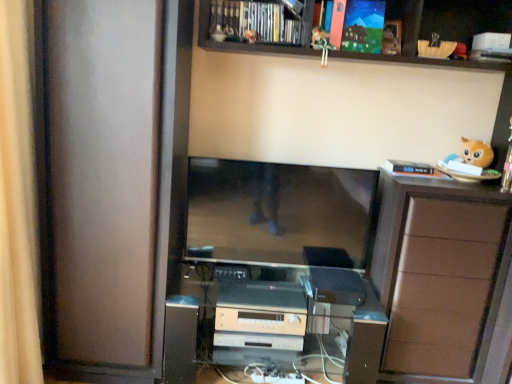
Question: Should I look upward or downward to see black plastic speaker at lower center, the 2th appliance when ordered from left to right?

Choices:
 (A) up
 (B) down

Answer: (B)

Question: Are wooden at upper center and brown wood cabinet at right far apart?

Choices:
 (A) no
 (B) yes

Answer: (A)

Question: Does wooden at upper center have a greater width compared to brown wood cabinet at right?

Choices:
 (A) no
 (B) yes

Answer: (A)

Question: Is wooden at upper center further to camera compared to brown wood cabinet at right?

Choices:
 (A) no
 (B) yes

Answer: (A)

Question: Is brown wood cabinet at right surrounded by wooden at upper center?

Choices:
 (A) yes
 (B) no

Answer: (B)

Question: From a real-world perspective, is wooden at upper center on brown wood cabinet at right?

Choices:
 (A) no
 (B) yes

Answer: (B)

Question: From a real-world perspective, is wooden at upper center under brown wood cabinet at right?

Choices:
 (A) yes
 (B) no

Answer: (B)

Question: Considering the relative sizes of satin silver stereo at center and wooden cabinet at upper center in the image provided, is satin silver stereo at center wider than wooden cabinet at upper center?

Choices:
 (A) no
 (B) yes

Answer: (B)

Question: Is satin silver stereo at center positioned far away from wooden cabinet at upper center?

Choices:
 (A) no
 (B) yes

Answer: (B)

Question: Is satin silver stereo at center to the right of wooden cabinet at upper center from the viewer's perspective?

Choices:
 (A) no
 (B) yes

Answer: (B)

Question: From the image's perspective, would you say satin silver stereo at center is shown under wooden cabinet at upper center?

Choices:
 (A) yes
 (B) no

Answer: (A)

Question: Is satin silver stereo at center closer to camera compared to wooden cabinet at upper center?

Choices:
 (A) no
 (B) yes

Answer: (B)

Question: Is satin silver stereo at center taller than wooden cabinet at upper center?

Choices:
 (A) yes
 (B) no

Answer: (A)

Question: Does matte brown screen door at left have a larger size compared to beige fabric curtain at left?

Choices:
 (A) yes
 (B) no

Answer: (A)